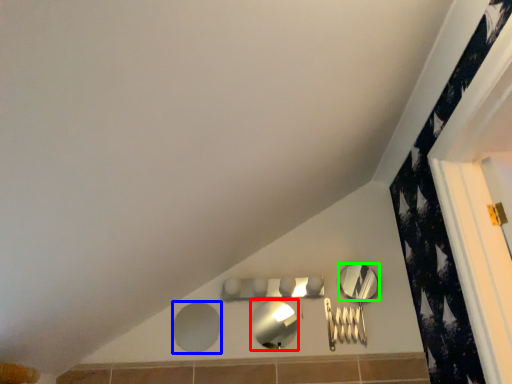
Question: Which object is the farthest from mirror (highlighted by a red box)? Choose among these: mirror (highlighted by a blue box) or mirror (highlighted by a green box).

Choices:
 (A) mirror
 (B) mirror

Answer: (B)